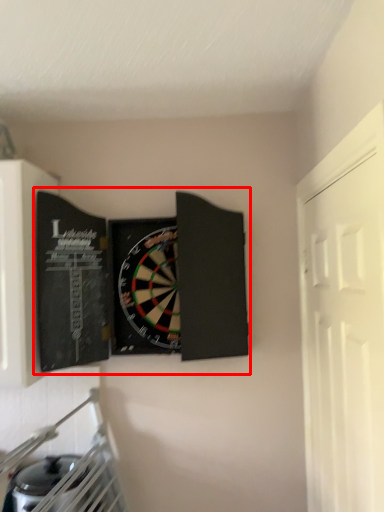
Question: From the image's perspective, considering the relative positions of book (annotated by the red box) and door in the image provided, where is book (annotated by the red box) located with respect to the staircase?

Choices:
 (A) below
 (B) above

Answer: (B)